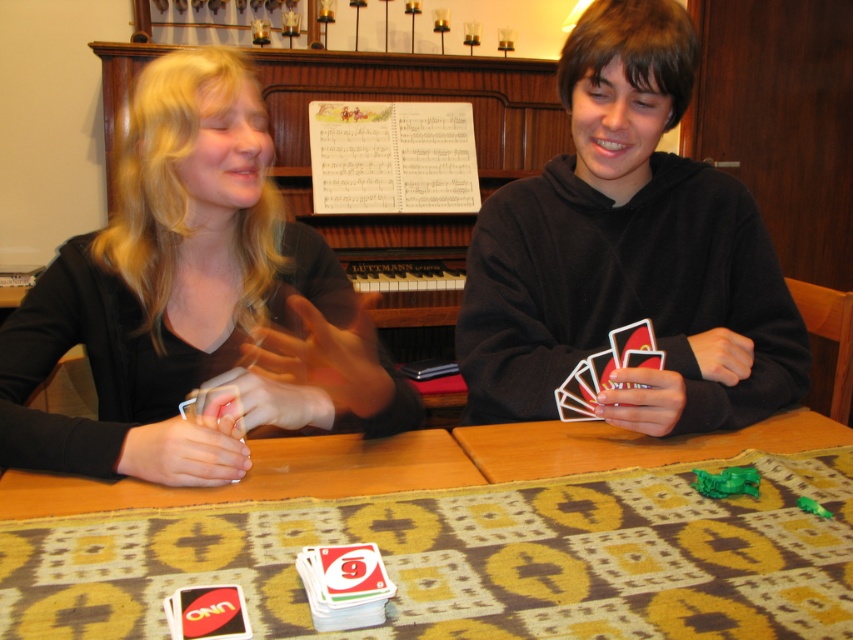
Describe the element at coordinates (193, 300) in the screenshot. I see `smooth black shirt at left` at that location.

I want to click on smooth black shirt at left, so click(193, 300).

Identify the location of smooth black shirt at left. This screenshot has width=853, height=640. (193, 300).

Between point (627, 33) and point (498, 339), which one is positioned in front?

Positioned in front is point (627, 33).

Identify the location of smooth plastic cards at center. (628, 252).

Does wooden table at center appear on the right side of black matte hoodie at center?

Incorrect, wooden table at center is not on the right side of black matte hoodie at center.

Is point (744, 456) less distant than point (570, 269)?

Yes, it is.

Identify the location of wooden table at center. This screenshot has width=853, height=640. (474, 544).

Identify the location of wooden table at center. Image resolution: width=853 pixels, height=640 pixels. (474, 544).